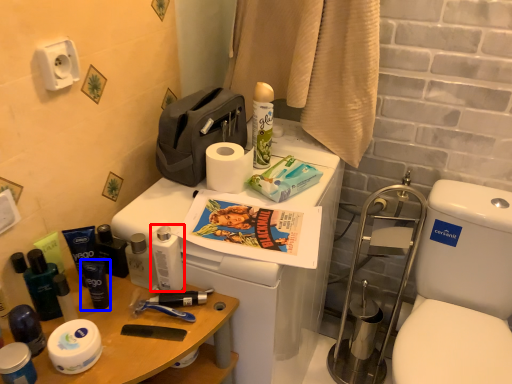
Question: Which point is further to the camera, toiletry (highlighted by a red box) or toiletry (highlighted by a blue box)?

Choices:
 (A) toiletry
 (B) toiletry

Answer: (B)